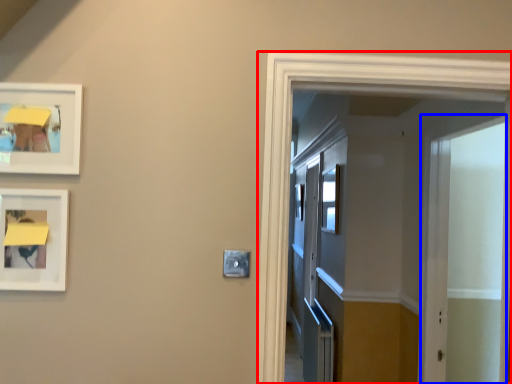
Question: Among these objects, which one is farthest to the camera, elevator (highlighted by a red box) or screen door (highlighted by a blue box)?

Choices:
 (A) elevator
 (B) screen door

Answer: (B)